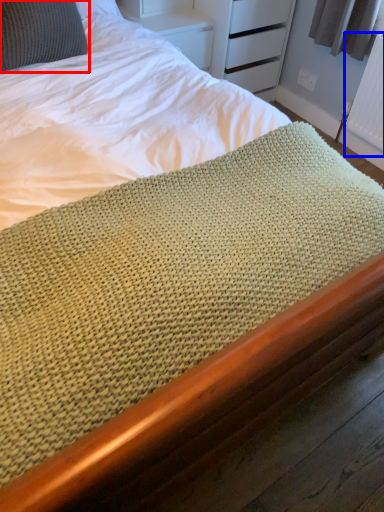
Question: Which of the following is the closest to the observer, pillow (highlighted by a red box) or radiator (highlighted by a blue box)?

Choices:
 (A) pillow
 (B) radiator

Answer: (A)